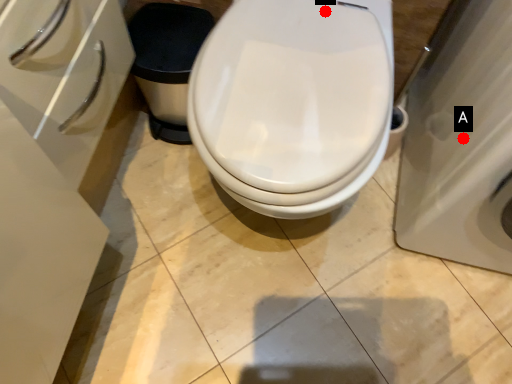
Question: Two points are circled on the image, labeled by A and B beside each circle. Which of the following is the farthest from the observer?

Choices:
 (A) A is further
 (B) B is further

Answer: (B)